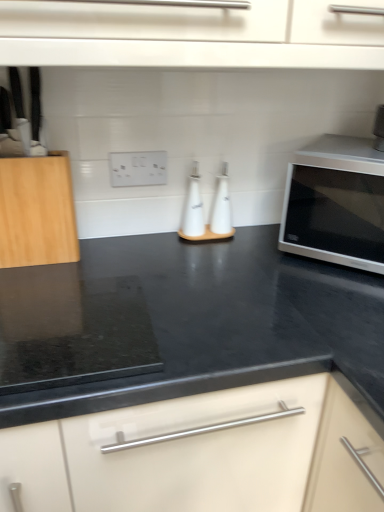
Question: From the image's perspective, is white glossy bottle at center, placed as the first bottle when sorted from right to left, located above natural wood cutting board at left?

Choices:
 (A) yes
 (B) no

Answer: (B)

Question: Could natural wood cutting board at left be considered to be inside white glossy bottle at center, placed as the first bottle when sorted from right to left?

Choices:
 (A) yes
 (B) no

Answer: (B)

Question: Considering the relative sizes of white glossy bottle at center, placed as the first bottle when sorted from right to left, and natural wood cutting board at left in the image provided, is white glossy bottle at center, placed as the first bottle when sorted from right to left, taller than natural wood cutting board at left?

Choices:
 (A) yes
 (B) no

Answer: (B)

Question: Does white glossy bottle at center, placed as the first bottle when sorted from right to left, turn towards natural wood cutting board at left?

Choices:
 (A) no
 (B) yes

Answer: (A)

Question: From a real-world perspective, is white glossy bottle at center, placed as the first bottle when sorted from right to left, on natural wood cutting board at left?

Choices:
 (A) no
 (B) yes

Answer: (A)

Question: Is white glossy bottle at center, the second bottle from the left, positioned with its back to natural wood cutting board at left?

Choices:
 (A) no
 (B) yes

Answer: (A)

Question: Is white plastic electric outlet at center at the back of white glossy bottle at center, the second bottle from the left?

Choices:
 (A) yes
 (B) no

Answer: (B)

Question: From the image's perspective, is white glossy bottle at center, placed as the first bottle when sorted from right to left, under white plastic electric outlet at center?

Choices:
 (A) yes
 (B) no

Answer: (A)

Question: Is white glossy bottle at center, placed as the first bottle when sorted from right to left, aimed at white plastic electric outlet at center?

Choices:
 (A) yes
 (B) no

Answer: (B)

Question: Is white glossy bottle at center, the second bottle from the left, smaller than white plastic electric outlet at center?

Choices:
 (A) yes
 (B) no

Answer: (B)

Question: Does white glossy bottle at center, placed as the first bottle when sorted from right to left, have a greater height compared to white plastic electric outlet at center?

Choices:
 (A) no
 (B) yes

Answer: (B)

Question: Is white glossy bottle at center, placed as the first bottle when sorted from right to left, outside of white plastic electric outlet at center?

Choices:
 (A) yes
 (B) no

Answer: (A)

Question: Is satin silver microwave at right wider than white matte oil bottle at center, which is the 1th bottle in left-to-right order?

Choices:
 (A) yes
 (B) no

Answer: (A)